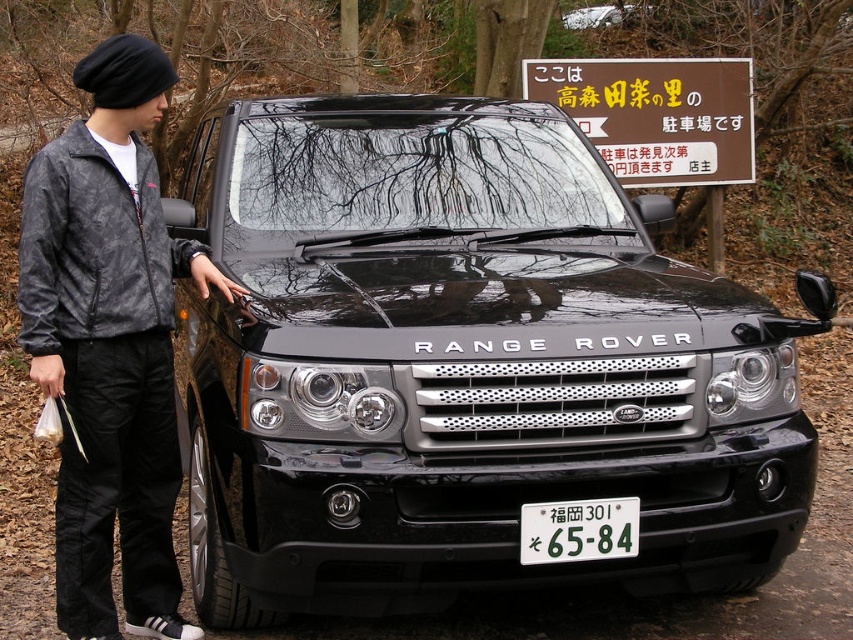
You are a delivery person who needs to confirm the license plate number of the black metallic car at center. Since the white plastic license plate at center is small, will you be able to read it clearly from your current position? Please explain your reasoning based on the size of the license plate relative to the car.

The white plastic license plate at center has a lesser width compared to the black metallic car at center. Since the license plate is smaller in width, it might be challenging to read the numbers and letters clearly from a distance without moving closer for a better view.

You are a delivery person who needs to deliver a package to the black metallic Range Rover at center. The license plate on the white plastic license plate at center must be visible for confirmation. Is the license plate currently visible to you?

The black metallic range rover at center is in front of the white plastic license plate at center, so the license plate is blocked and not visible.

You are a delivery person who needs to deliver a package to the owner of the black Range Rover parked outside. The license plate is crucial for verification. Where exactly is the white plastic license plate at center located in the image?

The white plastic license plate at center is located at point [578,531] in the image.